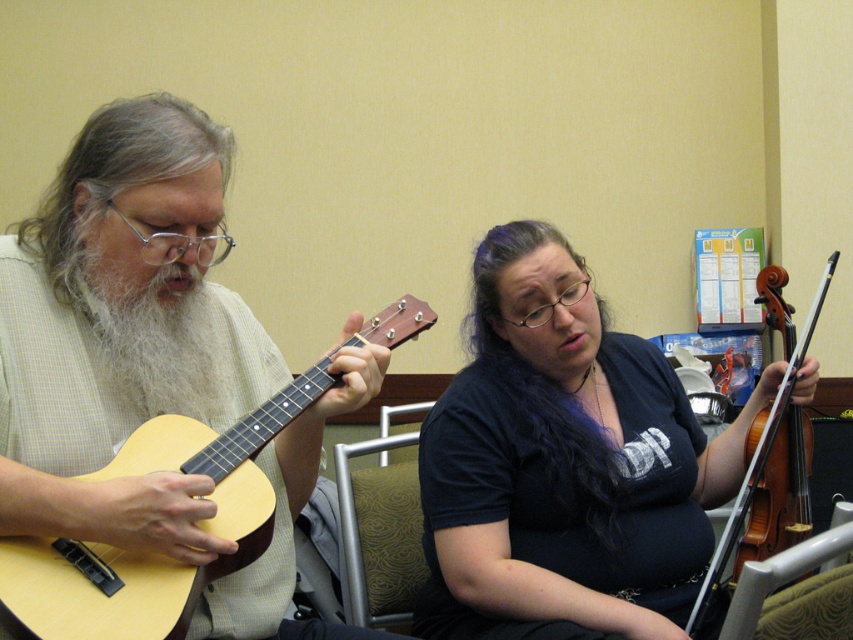
You are trying to decide whether to place a new plant pot between the light wood acoustic guitar at left and the purple silky hair at center. Based on their positions, will the plant pot fit horizontally between them?

The light wood acoustic guitar at left is located below purple silky hair at center, so placing a plant pot horizontally between them may not be possible since they are positioned vertically relative to each other.

You are standing in the room where the two musicians are playing. You want to take a photo of them using a camera that has a focal length of 50mm. The camera is placed at point (x=567, y=433). The minimum distance your camera needs to be from the subjects to avoid distortion is 1.5 meters. Is the camera positioned correctly?

The distance between the camera and the point (x=567, y=433) is 1.46 meters. Since this is less than the required 1.5 meters, the camera is too close and may cause distortion.

You are standing in the room where the two musicians are playing. You want to place a small stool between the two points labeled point (569,483) and point (746,456). Since the stool is only 0.1 meters wide, will it fit between them?

Point (569,483) is in front of point (746,456), so the distance between them is sufficient for the stool since it is only 0.1 meters wide.